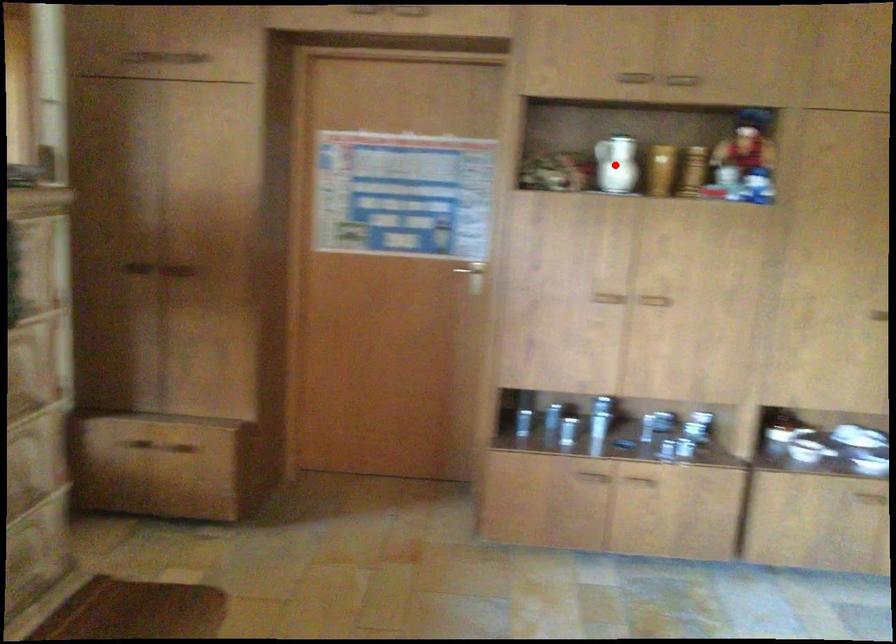
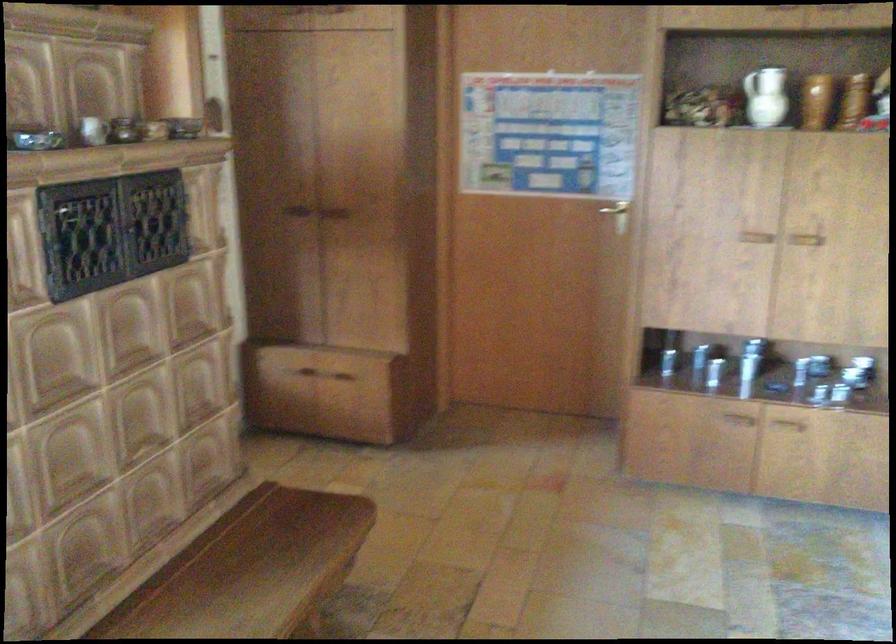
Find the pixel in the second image that matches the highlighted location in the first image.

(764, 96)